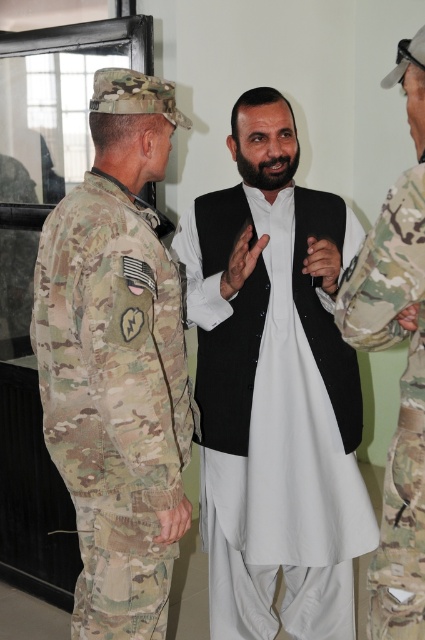
What do you see at coordinates (275, 416) in the screenshot? The image size is (425, 640). I see `black cotton vest at center` at bounding box center [275, 416].

Can you confirm if black cotton vest at center is wider than matte black hand at center?

Indeed, black cotton vest at center has a greater width compared to matte black hand at center.

This screenshot has height=640, width=425. I want to click on black cotton vest at center, so click(x=275, y=416).

Describe the element at coordinates (399, 396) in the screenshot. I see `camouflage fabric uniform at right` at that location.

Between camouflage fabric uniform at right and matte black phone at center, which one has more height?

With more height is camouflage fabric uniform at right.

Where is `camouflage fabric uniform at right`? The image size is (425, 640). camouflage fabric uniform at right is located at coordinates (399, 396).

Does matte black hand at center have a lesser height compared to matte black phone at center?

Incorrect, matte black hand at center's height does not fall short of matte black phone at center's.

Is matte black hand at center below matte black phone at center?

No.

Where is `matte black hand at center`? The image size is (425, 640). matte black hand at center is located at coordinates (240, 260).

The width and height of the screenshot is (425, 640). What are the coordinates of `matte black hand at center` in the screenshot? It's located at (240, 260).